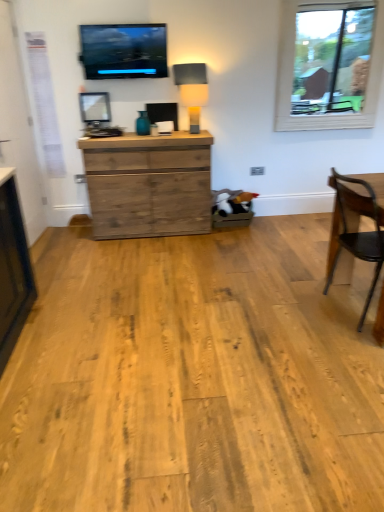
Question: Can you confirm if rustic wood chest of drawers at center is smaller than matte beige lampshade at center?

Choices:
 (A) yes
 (B) no

Answer: (B)

Question: Considering the relative positions of rustic wood chest of drawers at center and matte beige lampshade at center in the image provided, is rustic wood chest of drawers at center behind matte beige lampshade at center?

Choices:
 (A) yes
 (B) no

Answer: (B)

Question: Is rustic wood chest of drawers at center with matte beige lampshade at center?

Choices:
 (A) no
 (B) yes

Answer: (A)

Question: Can you confirm if rustic wood chest of drawers at center is wider than matte beige lampshade at center?

Choices:
 (A) no
 (B) yes

Answer: (B)

Question: Does rustic wood chest of drawers at center have a lesser height compared to matte beige lampshade at center?

Choices:
 (A) yes
 (B) no

Answer: (B)

Question: Based on their positions, is rustic wood chest of drawers at center located to the left or right of wooden chair at right?

Choices:
 (A) left
 (B) right

Answer: (A)

Question: Is rustic wood chest of drawers at center taller or shorter than wooden chair at right?

Choices:
 (A) tall
 (B) short

Answer: (B)

Question: In terms of width, does rustic wood chest of drawers at center look wider or thinner when compared to wooden chair at right?

Choices:
 (A) wide
 (B) thin

Answer: (B)

Question: Looking at the image, does rustic wood chest of drawers at center seem bigger or smaller compared to wooden chair at right?

Choices:
 (A) big
 (B) small

Answer: (A)

Question: Looking at their shapes, would you say matte black screen at upper center is wider or thinner than rustic wood chest of drawers at center?

Choices:
 (A) thin
 (B) wide

Answer: (A)

Question: Looking at the image, does matte black screen at upper center seem bigger or smaller compared to rustic wood chest of drawers at center?

Choices:
 (A) big
 (B) small

Answer: (B)

Question: Is matte black screen at upper center in front of or behind rustic wood chest of drawers at center in the image?

Choices:
 (A) front
 (B) behind

Answer: (A)

Question: Visually, is matte black screen at upper center positioned to the left or to the right of rustic wood chest of drawers at center?

Choices:
 (A) left
 (B) right

Answer: (A)

Question: Which is correct: wooden chair at right is inside rustic wood chest of drawers at center, or outside of it?

Choices:
 (A) inside
 (B) outside

Answer: (B)

Question: Considering the positions of wooden chair at right and rustic wood chest of drawers at center in the image, is wooden chair at right taller or shorter than rustic wood chest of drawers at center?

Choices:
 (A) tall
 (B) short

Answer: (A)